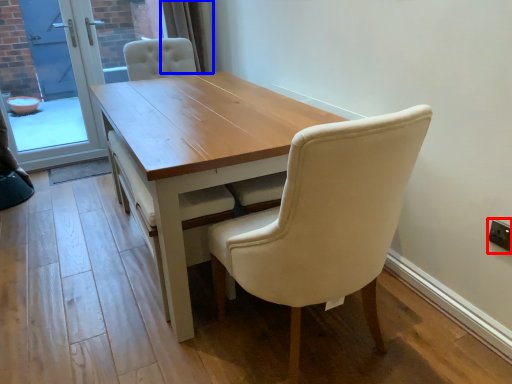
Question: Which of the following is the closest to the observer, electric outlet (highlighted by a red box) or curtain (highlighted by a blue box)?

Choices:
 (A) electric outlet
 (B) curtain

Answer: (A)